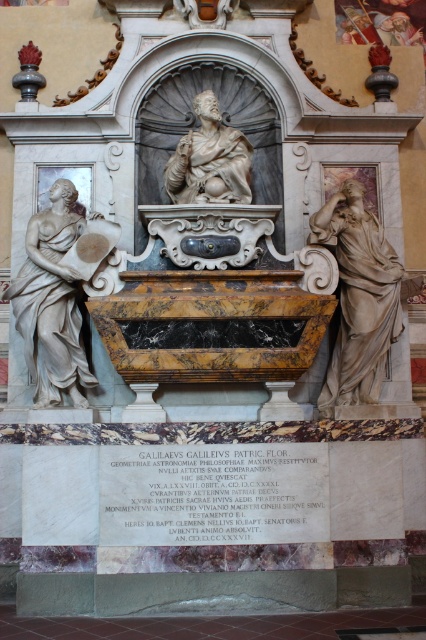
Can you confirm if matte white statue at right is thinner than marble statue at center?

Incorrect, matte white statue at right's width is not less than marble statue at center's.

Is point (371, 339) farther from camera compared to point (238, 150)?

No, it is in front of (238, 150).

Between point (379, 384) and point (250, 188), which one is positioned behind?

The point (250, 188) is more distant.

The image size is (426, 640). I want to click on matte white statue at right, so click(x=359, y=298).

Is white marble statue at left below marble statue at center?

Indeed, white marble statue at left is positioned under marble statue at center.

Which of these two, white marble statue at left or marble statue at center, stands taller?

With more height is white marble statue at left.

The width and height of the screenshot is (426, 640). Find the location of `white marble statue at left`. white marble statue at left is located at coordinates (51, 301).

Where is `white marble statue at left`? white marble statue at left is located at coordinates (51, 301).

Is matte white statue at right to the left of white marble statue at left from the viewer's perspective?

No, matte white statue at right is not to the left of white marble statue at left.

Is point (339, 388) positioned behind point (39, 374)?

That is True.

Where is `matte white statue at right`? This screenshot has width=426, height=640. matte white statue at right is located at coordinates (359, 298).

What are the coordinates of `matte white statue at right` in the screenshot? It's located at (359, 298).